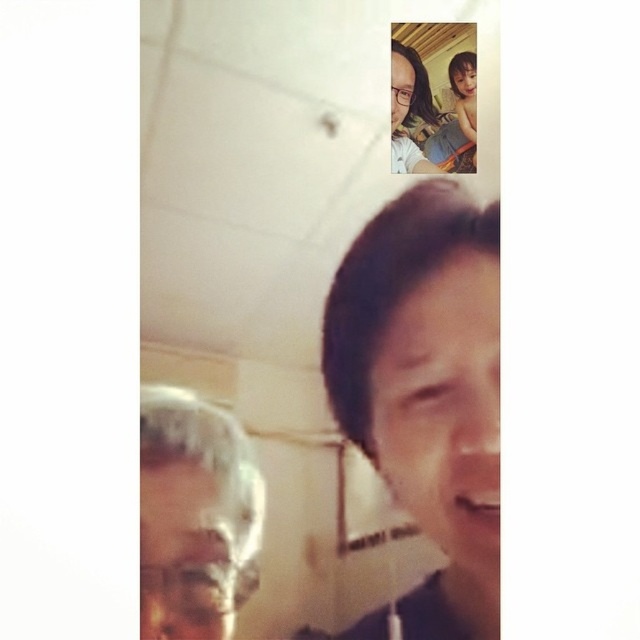
Question: From the image, what is the correct spatial relationship of matte black hair at upper right in relation to smooth skin face at upper right?

Choices:
 (A) below
 (B) above

Answer: (A)

Question: Considering the real-world distances, which object is farthest from the smooth plastic cup at lower left?

Choices:
 (A) matte black hair at upper right
 (B) matte black glasses at upper center

Answer: (B)

Question: Observing the image, what is the correct spatial positioning of matte black hair at upper right in reference to smooth skin face at upper right?

Choices:
 (A) above
 (B) below

Answer: (B)

Question: In this image, where is matte skin face at center located relative to smooth plastic cup at lower left?

Choices:
 (A) below
 (B) above

Answer: (B)

Question: Which of these objects is positioned farthest from the smooth skin face at upper right?

Choices:
 (A) matte skin face at center
 (B) matte black hair at upper right

Answer: (A)

Question: Which point appears closest to the camera in this image?

Choices:
 (A) (189, 573)
 (B) (406, 99)

Answer: (A)